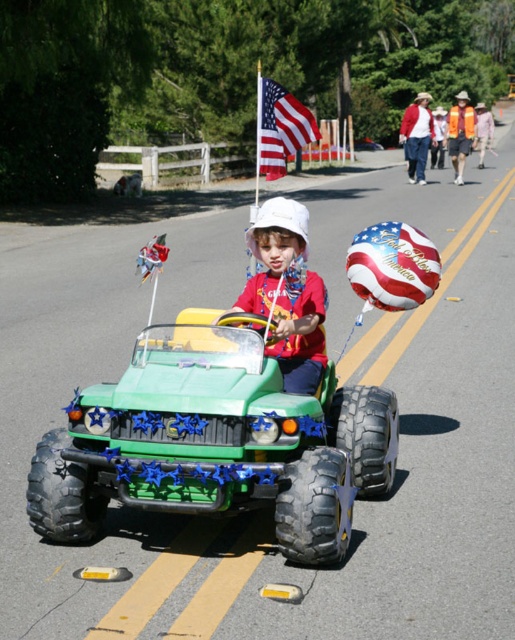
From the picture: Which is above, white matte hat at center or orange safety vest at center?

orange safety vest at center is above.

Who is taller, white matte hat at center or orange safety vest at center?

orange safety vest at center

Who is more distant from viewer, (317, 332) or (473, 144)?

The point (473, 144) is behind.

Image resolution: width=515 pixels, height=640 pixels. What are the coordinates of `white matte hat at center` in the screenshot? It's located at (286, 294).

Can you confirm if green rubber monster truck at center is bigger than orange safety vest at center?

No.

Who is taller, green rubber monster truck at center or orange safety vest at center?

orange safety vest at center is taller.

Where is `green rubber monster truck at center`? green rubber monster truck at center is located at coordinates (215, 442).

Is american flag at center to the left of orange safety vest at center from the viewer's perspective?

Yes, american flag at center is to the left of orange safety vest at center.

Who is positioned more to the right, american flag at center or orange safety vest at center?

Positioned to the right is orange safety vest at center.

Where is `american flag at center`? This screenshot has height=640, width=515. american flag at center is located at coordinates (280, 128).